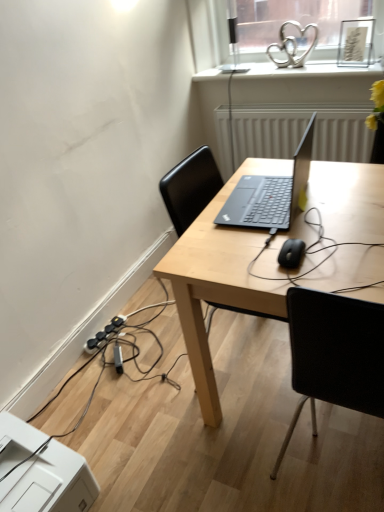
The height and width of the screenshot is (512, 384). Identify the location of free space to the back side of black matte mouse at center. [x=289, y=227].